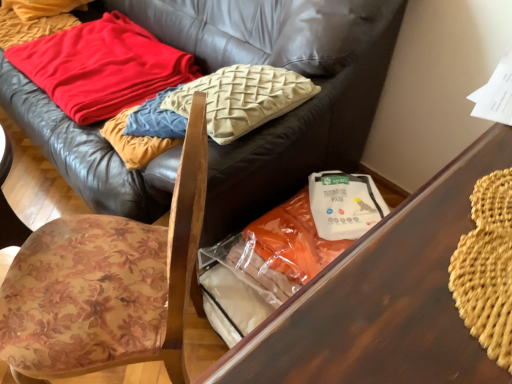
Where is `leather couch at upper center`? leather couch at upper center is located at coordinates (298, 141).

The height and width of the screenshot is (384, 512). What are the coordinates of `floral fabric chair at left` in the screenshot? It's located at (106, 284).

Is wooden table at center positioned with its back to floral fabric chair at left?

No, wooden table at center's orientation is not away from floral fabric chair at left.

Considering the relative sizes of wooden table at center and floral fabric chair at left in the image provided, is wooden table at center shorter than floral fabric chair at left?

In fact, wooden table at center may be taller than floral fabric chair at left.

Is point (202, 377) positioned before point (53, 319)?

Yes.

From the image's perspective, is wooden table at center above or below floral fabric chair at left?

wooden table at center is situated lower than floral fabric chair at left in the image.

Which of these two, floral fabric chair at left or red soft fabric blanket at upper left, stands taller?

With more height is floral fabric chair at left.

Can you confirm if floral fabric chair at left is wider than red soft fabric blanket at upper left?

No.

Considering the sizes of objects floral fabric chair at left and red soft fabric blanket at upper left in the image provided, who is smaller, floral fabric chair at left or red soft fabric blanket at upper left?

red soft fabric blanket at upper left.

Is wooden table at center oriented towards red soft fabric blanket at upper left?

Yes, wooden table at center faces towards red soft fabric blanket at upper left.

Would you say wooden table at center contains red soft fabric blanket at upper left?

That's incorrect, red soft fabric blanket at upper left is not inside wooden table at center.

Can you confirm if wooden table at center is positioned to the left of red soft fabric blanket at upper left?

In fact, wooden table at center is to the right of red soft fabric blanket at upper left.

Which of these two, wooden table at center or red soft fabric blanket at upper left, stands shorter?

red soft fabric blanket at upper left is shorter.

Which point is more distant from viewer, (281, 166) or (379, 223)?

The point (281, 166) is farther from the camera.

Which of these two, leather couch at upper center or wooden table at center, is smaller?

With smaller size is wooden table at center.

Are leather couch at upper center and wooden table at center making contact?

leather couch at upper center and wooden table at center are clearly separated.

How many degrees apart are the facing directions of leather couch at upper center and wooden table at center?

90.1 degrees separate the facing orientations of leather couch at upper center and wooden table at center.

Is leather couch at upper center oriented towards red soft fabric blanket at upper left?

Yes, leather couch at upper center is facing red soft fabric blanket at upper left.

Can you confirm if leather couch at upper center is positioned to the right of red soft fabric blanket at upper left?

Indeed, leather couch at upper center is positioned on the right side of red soft fabric blanket at upper left.

From the image's perspective, would you say leather couch at upper center is shown under red soft fabric blanket at upper left?

No, from the image's perspective, leather couch at upper center is not beneath red soft fabric blanket at upper left.

Can you tell me how much red soft fabric blanket at upper left and leather couch at upper center differ in facing direction?

red soft fabric blanket at upper left and leather couch at upper center are facing 2.83 degrees away from each other.

Which of these two, red soft fabric blanket at upper left or leather couch at upper center, is thinner?

red soft fabric blanket at upper left is thinner.

Does red soft fabric blanket at upper left have a greater height compared to leather couch at upper center?

No.

From a real-world perspective, which is physically below, red soft fabric blanket at upper left or leather couch at upper center?

red soft fabric blanket at upper left.

From a real-world perspective, does red soft fabric blanket at upper left sit lower than floral fabric chair at left?

Correct, in the physical world, red soft fabric blanket at upper left is lower than floral fabric chair at left.

Is red soft fabric blanket at upper left in front of or behind floral fabric chair at left in the image?

Visually, red soft fabric blanket at upper left is located behind floral fabric chair at left.

Is red soft fabric blanket at upper left turned away from floral fabric chair at left?

No, floral fabric chair at left is not at the back of red soft fabric blanket at upper left.

Would you say red soft fabric blanket at upper left contains floral fabric chair at left?

No.

Where is `chair that is above the wooden table at center (from the image's perspective)`? chair that is above the wooden table at center (from the image's perspective) is located at coordinates (106, 284).

Locate an element on the screen. This screenshot has width=512, height=384. chair on the right side of red soft fabric blanket at upper left is located at coordinates (106, 284).

Estimate the real-world distances between objects in this image. Which object is closer to red soft fabric blanket at upper left, floral fabric chair at left or leather couch at upper center?

The object closer to red soft fabric blanket at upper left is leather couch at upper center.

Considering their positions, is wooden table at center positioned further to red soft fabric blanket at upper left than leather couch at upper center?

wooden table at center lies further to red soft fabric blanket at upper left than the other object.

When comparing their distances from floral fabric chair at left, does red soft fabric blanket at upper left or leather couch at upper center seem further?

red soft fabric blanket at upper left is positioned further to the anchor floral fabric chair at left.

From the image, which object appears to be farther from wooden table at center, leather couch at upper center or red soft fabric blanket at upper left?

red soft fabric blanket at upper left is further to wooden table at center.

Based on their spatial positions, is red soft fabric blanket at upper left or leather couch at upper center closer to wooden table at center?

Based on the image, leather couch at upper center appears to be nearer to wooden table at center.

Looking at the image, which one is located further to leather couch at upper center, red soft fabric blanket at upper left or wooden table at center?

wooden table at center is positioned further to the anchor leather couch at upper center.

Based on their spatial positions, is floral fabric chair at left or red soft fabric blanket at upper left further from leather couch at upper center?

Among the two, floral fabric chair at left is located further to leather couch at upper center.

Looking at the image, which one is located closer to floral fabric chair at left, leather couch at upper center or wooden table at center?

leather couch at upper center is closer to floral fabric chair at left.

Find the location of `studio couch between floral fabric chair at left and red soft fabric blanket at upper left along the z-axis`. studio couch between floral fabric chair at left and red soft fabric blanket at upper left along the z-axis is located at coordinates (298, 141).

Locate an element on the screen. Image resolution: width=512 pixels, height=384 pixels. chair between leather couch at upper center and wooden table at center vertically is located at coordinates (106, 284).

You are a GUI agent. You are given a task and a screenshot of the screen. Output one action in this format:
    pyautogui.click(x=<x>, y=<y>)
    Task: Click on the studio couch positioned between wooden table at center and red soft fabric blanket at upper left from near to far
    This screenshot has width=512, height=384.
    Given the screenshot: What is the action you would take?
    pyautogui.click(x=298, y=141)

Where is `chair between wooden table at center and red soft fabric blanket at upper left from front to back`? The height and width of the screenshot is (384, 512). chair between wooden table at center and red soft fabric blanket at upper left from front to back is located at coordinates (106, 284).